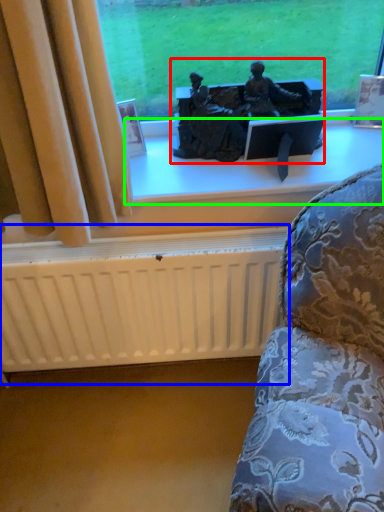
Question: Which object is positioned closest to sculpture (highlighted by a red box)? Select from radiator (highlighted by a blue box) and window sill (highlighted by a green box).

Choices:
 (A) radiator
 (B) window sill

Answer: (B)